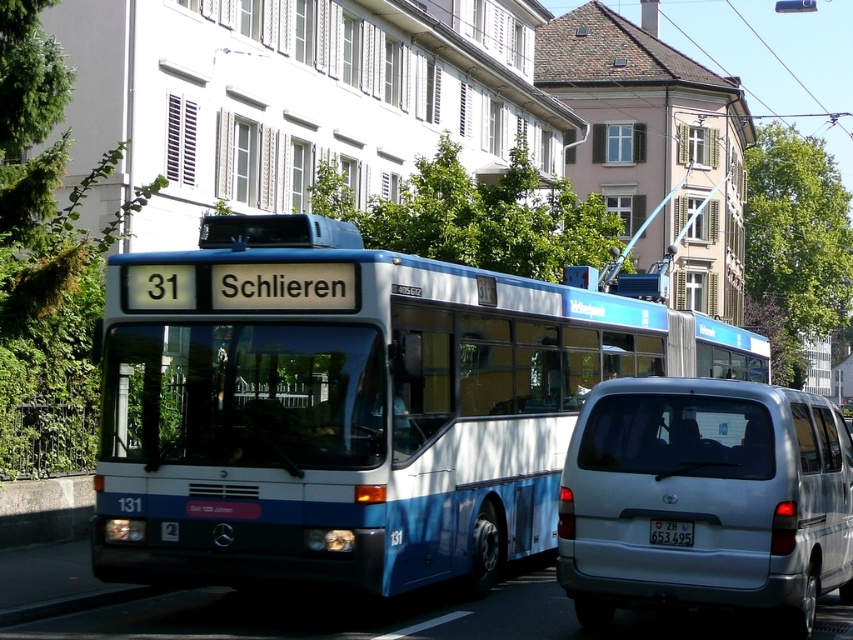
Does silver metallic van at lower right have a lesser height compared to white plastic license plate at center?

Incorrect, silver metallic van at lower right's height does not fall short of white plastic license plate at center's.

Is point (850, 545) less distant than point (659, 528)?

No, it is not.

Identify the location of silver metallic van at lower right. This screenshot has height=640, width=853. (706, 499).

Can you confirm if blue metallic bus at center is shorter than white plastic license plate at center?

No, blue metallic bus at center is not shorter than white plastic license plate at center.

Between point (302, 568) and point (653, 520), which one is positioned in front?

Point (653, 520)

Who is more distant from viewer, [247,426] or [688,529]?

Point [247,426]

Where is `blue metallic bus at center`? Image resolution: width=853 pixels, height=640 pixels. blue metallic bus at center is located at coordinates (352, 406).

Is blue metallic bus at center thinner than silver metallic van at lower right?

Yes, blue metallic bus at center is thinner than silver metallic van at lower right.

In the scene shown: Who is positioned more to the left, blue metallic bus at center or silver metallic van at lower right?

blue metallic bus at center

Image resolution: width=853 pixels, height=640 pixels. I want to click on blue metallic bus at center, so click(x=352, y=406).